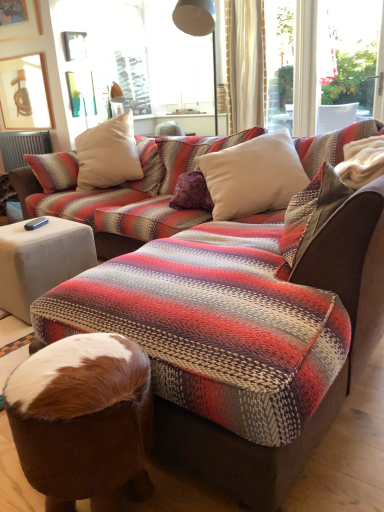
Question: Does white fabric side table at lower left appear on the left side of brown fur bean bag chair at lower center?

Choices:
 (A) no
 (B) yes

Answer: (B)

Question: Considering the relative positions of white fabric side table at lower left and brown fur bean bag chair at lower center in the image provided, is white fabric side table at lower left to the right of brown fur bean bag chair at lower center from the viewer's perspective?

Choices:
 (A) no
 (B) yes

Answer: (A)

Question: Is white fabric side table at lower left far away from brown fur bean bag chair at lower center?

Choices:
 (A) no
 (B) yes

Answer: (B)

Question: From the image's perspective, would you say white fabric side table at lower left is positioned over brown fur bean bag chair at lower center?

Choices:
 (A) yes
 (B) no

Answer: (A)

Question: Is white fabric side table at lower left oriented away from brown fur bean bag chair at lower center?

Choices:
 (A) no
 (B) yes

Answer: (A)

Question: From the image's perspective, is white soft cushion at upper center, arranged as the first pillow when viewed from the front, above or below white soft cushion at center, the second pillow when ordered from front to back?

Choices:
 (A) below
 (B) above

Answer: (A)

Question: Considering the positions of white soft cushion at upper center, the 2th pillow in the back-to-front sequence, and white soft cushion at center, the second pillow when ordered from front to back, in the image, is white soft cushion at upper center, the 2th pillow in the back-to-front sequence, bigger or smaller than white soft cushion at center, the second pillow when ordered from front to back,?

Choices:
 (A) small
 (B) big

Answer: (A)

Question: From a real-world perspective, is white soft cushion at upper center, arranged as the first pillow when viewed from the front, physically located above or below white soft cushion at center, the second pillow when ordered from front to back?

Choices:
 (A) below
 (B) above

Answer: (B)

Question: Considering the relative positions of white soft cushion at upper center, the 2th pillow in the back-to-front sequence, and white soft cushion at center, acting as the 1th pillow starting from the back, in the image provided, is white soft cushion at upper center, the 2th pillow in the back-to-front sequence, to the left or to the right of white soft cushion at center, acting as the 1th pillow starting from the back,?

Choices:
 (A) right
 (B) left

Answer: (A)

Question: From a real-world perspective, is white soft cushion at center, acting as the 1th pillow starting from the back, physically located above or below wooden picture frame at upper left?

Choices:
 (A) below
 (B) above

Answer: (A)

Question: Is point (256, 174) positioned closer to the camera than point (14, 71)?

Choices:
 (A) closer
 (B) farther

Answer: (A)

Question: Relative to wooden picture frame at upper left, is white soft cushion at center, the second pillow when ordered from front to back, in front or behind?

Choices:
 (A) behind
 (B) front

Answer: (B)

Question: Based on their positions, is white soft cushion at center, acting as the 1th pillow starting from the back, located to the left or right of wooden picture frame at upper left?

Choices:
 (A) right
 (B) left

Answer: (A)

Question: Considering the positions of white soft cushion at upper center, arranged as the first pillow when viewed from the front, and wooden picture frame at upper left in the image, is white soft cushion at upper center, arranged as the first pillow when viewed from the front, bigger or smaller than wooden picture frame at upper left?

Choices:
 (A) small
 (B) big

Answer: (B)

Question: From the image's perspective, is white soft cushion at upper center, the 2th pillow in the back-to-front sequence, positioned above or below wooden picture frame at upper left?

Choices:
 (A) above
 (B) below

Answer: (B)